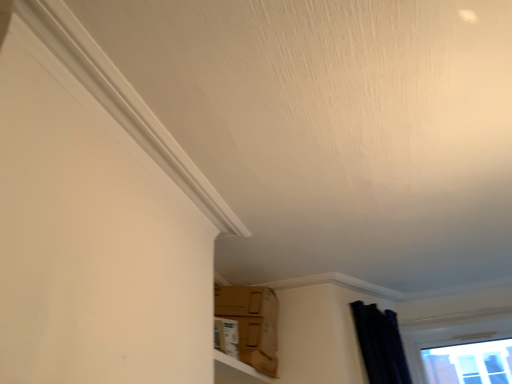
This screenshot has height=384, width=512. Identify the location of brown cardboard box at lower center. (236, 371).

Describe the element at coordinates (236, 371) in the screenshot. I see `brown cardboard box at lower center` at that location.

In order to face brown cardboard box at lower center, should I rotate leftwards or rightwards?

Rotate left and turn 0.587 degrees.

Locate an element on the screen. brown cardboard box at lower center is located at coordinates (236, 371).